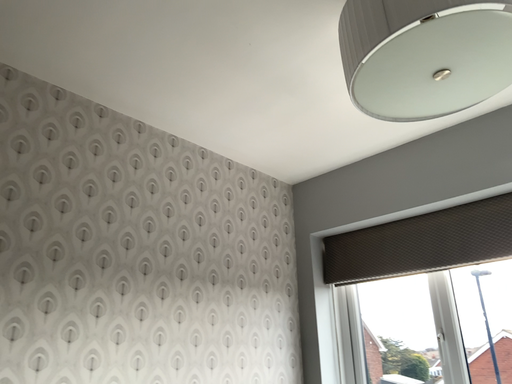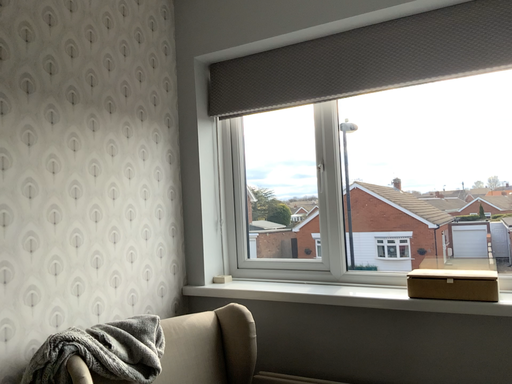
Question: How did the camera likely rotate when shooting the video?

Choices:
 (A) rotated right
 (B) rotated left

Answer: (A)